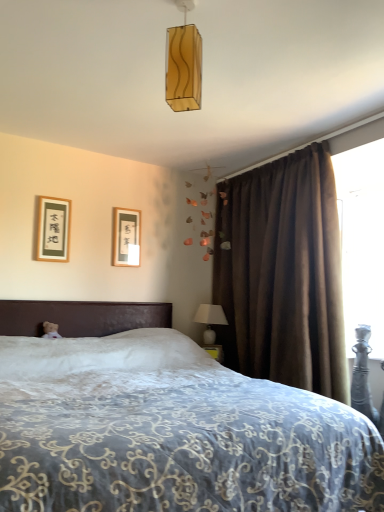
Describe the element at coordinates (364, 379) in the screenshot. This screenshot has height=512, width=384. I see `metallic silver swivel chair at lower right` at that location.

Describe the element at coordinates (53, 229) in the screenshot. I see `matte black picture frame at upper left, the first picture frame from the left` at that location.

You are a GUI agent. You are given a task and a screenshot of the screen. Output one action in this format:
    pyautogui.click(x=<x>, y=<y>)
    Task: Click on the translucent amber glass rectangular pendant light at upper center
    The image size is (384, 512).
    Given the screenshot: What is the action you would take?
    pyautogui.click(x=183, y=64)

Find the location of `wooden picture frame at upper left, which is the first picture frame in back-to-front order`. wooden picture frame at upper left, which is the first picture frame in back-to-front order is located at coordinates pos(127,237).

Locate an element on the screen. The height and width of the screenshot is (512, 384). transparent plastic screen at upper right is located at coordinates (362, 240).

Locate an element on the screen. This screenshot has width=384, height=512. metallic silver swivel chair at lower right is located at coordinates (364, 379).

Is white embroidered bed at center at the right side of white ceramic table lamp at right?

No.

In the scene shown: Which is in front, white embroidered bed at center or white ceramic table lamp at right?

white embroidered bed at center is more forward.

In order to click on table lamp on the right side of white embroidered bed at center in this screenshot , I will do `click(210, 320)`.

From the picture: Which point is more distant from viewer, (25, 354) or (209, 307)?

The point (209, 307) is behind.

From a real-world perspective, which is physically below, metallic silver swivel chair at lower right or white ceramic table lamp at right?

metallic silver swivel chair at lower right.

Considering the sizes of objects metallic silver swivel chair at lower right and white ceramic table lamp at right in the image provided, who is taller, metallic silver swivel chair at lower right or white ceramic table lamp at right?

With more height is metallic silver swivel chair at lower right.

From the image's perspective, does metallic silver swivel chair at lower right appear higher than white ceramic table lamp at right?

No, from the image's perspective, metallic silver swivel chair at lower right is not above white ceramic table lamp at right.

Considering the relative sizes of brown velvet curtain at right and transparent plastic screen at upper right in the image provided, is brown velvet curtain at right smaller than transparent plastic screen at upper right?

Actually, brown velvet curtain at right might be larger than transparent plastic screen at upper right.

Between brown velvet curtain at right and transparent plastic screen at upper right, which one has smaller width?

With smaller width is transparent plastic screen at upper right.

Is brown velvet curtain at right not inside transparent plastic screen at upper right?

brown velvet curtain at right is positioned outside transparent plastic screen at upper right.

From a real-world perspective, is brown velvet curtain at right physically located above or below transparent plastic screen at upper right?

Clearly, from a real-world perspective, brown velvet curtain at right is below transparent plastic screen at upper right.

Is metallic silver swivel chair at lower right shorter than wooden picture frame at upper left, marked as the 2th picture frame in a front-to-back arrangement?

No.

Can wooden picture frame at upper left, positioned as the 1th picture frame in right-to-left order, be found inside metallic silver swivel chair at lower right?

That's incorrect, wooden picture frame at upper left, positioned as the 1th picture frame in right-to-left order, is not inside metallic silver swivel chair at lower right.

From a real-world perspective, is translucent amber glass rectangular pendant light at upper center on wooden picture frame at upper left, positioned as the 1th picture frame in right-to-left order?

Yes, from a real-world perspective, translucent amber glass rectangular pendant light at upper center is above wooden picture frame at upper left, positioned as the 1th picture frame in right-to-left order.

You are a GUI agent. You are given a task and a screenshot of the screen. Output one action in this format:
    pyautogui.click(x=<x>, y=<y>)
    Task: Click on the light fixture lying on the right of wooden picture frame at upper left, marked as the 2th picture frame in a front-to-back arrangement
    This screenshot has width=384, height=512.
    Given the screenshot: What is the action you would take?
    pyautogui.click(x=183, y=64)

Which point is more forward, [181,42] or [124,211]?

Point [181,42]

Can we say translucent amber glass rectangular pendant light at upper center lies outside brown velvet curtain at right?

Yes, translucent amber glass rectangular pendant light at upper center is located beyond the bounds of brown velvet curtain at right.

Is translucent amber glass rectangular pendant light at upper center further to the viewer compared to brown velvet curtain at right?

No, it is not.

Considering the points (191, 80) and (235, 309), which point is behind, point (191, 80) or point (235, 309)?

The point (235, 309) is more distant.

How many degrees apart are the facing directions of translucent amber glass rectangular pendant light at upper center and brown velvet curtain at right?

The angle between the facing direction of translucent amber glass rectangular pendant light at upper center and the facing direction of brown velvet curtain at right is 90.2 degrees.

Based on the photo, can you confirm if wooden picture frame at upper left, which is the first picture frame in back-to-front order, is positioned to the right of metallic silver swivel chair at lower right?

No, wooden picture frame at upper left, which is the first picture frame in back-to-front order, is not to the right of metallic silver swivel chair at lower right.

Considering the sizes of objects wooden picture frame at upper left, which is the first picture frame in back-to-front order, and metallic silver swivel chair at lower right in the image provided, who is thinner, wooden picture frame at upper left, which is the first picture frame in back-to-front order, or metallic silver swivel chair at lower right?

With smaller width is wooden picture frame at upper left, which is the first picture frame in back-to-front order.

Is wooden picture frame at upper left, arranged as the 2th picture frame when viewed from the left, taller or shorter than metallic silver swivel chair at lower right?

Considering their sizes, wooden picture frame at upper left, arranged as the 2th picture frame when viewed from the left, has less height than metallic silver swivel chair at lower right.

Which is closer, (122,242) or (354,372)?

Point (122,242).

Locate an element on the screen. The height and width of the screenshot is (512, 384). bed lying on the left of white ceramic table lamp at right is located at coordinates (164, 423).

You are a GUI agent. You are given a task and a screenshot of the screen. Output one action in this format:
    pyautogui.click(x=<x>, y=<y>)
    Task: Click on the table lamp behind the metallic silver swivel chair at lower right
    The height and width of the screenshot is (512, 384).
    Given the screenshot: What is the action you would take?
    pyautogui.click(x=210, y=320)

In the scene shown: Based on their spatial positions, is metallic silver swivel chair at lower right or transparent plastic screen at upper right further from wooden picture frame at upper left, positioned as the 1th picture frame in right-to-left order?

Based on the image, metallic silver swivel chair at lower right appears to be further to wooden picture frame at upper left, positioned as the 1th picture frame in right-to-left order.

From the image, which object appears to be farther from brown velvet curtain at right, metallic silver swivel chair at lower right or matte black picture frame at upper left, which is the first picture frame in front-to-back order?

Based on the image, matte black picture frame at upper left, which is the first picture frame in front-to-back order, appears to be further to brown velvet curtain at right.

Which object lies nearer to the anchor point wooden picture frame at upper left, marked as the 2th picture frame in a front-to-back arrangement, brown velvet curtain at right or translucent amber glass rectangular pendant light at upper center?

brown velvet curtain at right.

Looking at the image, which one is located closer to matte black picture frame at upper left, which is counted as the second picture frame, starting from the right, white ceramic table lamp at right or transparent plastic screen at upper right?

white ceramic table lamp at right is positioned closer to the anchor matte black picture frame at upper left, which is counted as the second picture frame, starting from the right.

When comparing their distances from white plush teddy bear at left, does matte black picture frame at upper left, which is counted as the second picture frame, starting from the right, or white ceramic table lamp at right seem closer?

matte black picture frame at upper left, which is counted as the second picture frame, starting from the right, lies closer to white plush teddy bear at left than the other object.

Based on their spatial positions, is brown velvet curtain at right or white plush teddy bear at left further from white embroidered bed at center?

white plush teddy bear at left.

Considering their positions, is wooden picture frame at upper left, marked as the 2th picture frame in a front-to-back arrangement, positioned further to metallic silver swivel chair at lower right than transparent plastic screen at upper right?

wooden picture frame at upper left, marked as the 2th picture frame in a front-to-back arrangement, lies further to metallic silver swivel chair at lower right than the other object.

In the scene shown: Considering their positions, is white plush teddy bear at left positioned closer to white embroidered bed at center than white ceramic table lamp at right?

white plush teddy bear at left is positioned closer to the anchor white embroidered bed at center.

The width and height of the screenshot is (384, 512). Find the location of `picture frame situated between matte black picture frame at upper left, the first picture frame from the left, and transparent plastic screen at upper right from left to right`. picture frame situated between matte black picture frame at upper left, the first picture frame from the left, and transparent plastic screen at upper right from left to right is located at coordinates (127, 237).

I want to click on curtain situated between white ceramic table lamp at right and metallic silver swivel chair at lower right from left to right, so click(283, 274).

The width and height of the screenshot is (384, 512). I want to click on picture frame located between matte black picture frame at upper left, the first picture frame from the left, and white ceramic table lamp at right in the left-right direction, so click(x=127, y=237).

Where is `swivel chair between translucent amber glass rectangular pendant light at upper center and white ceramic table lamp at right along the z-axis`? This screenshot has width=384, height=512. swivel chair between translucent amber glass rectangular pendant light at upper center and white ceramic table lamp at right along the z-axis is located at coordinates (364, 379).